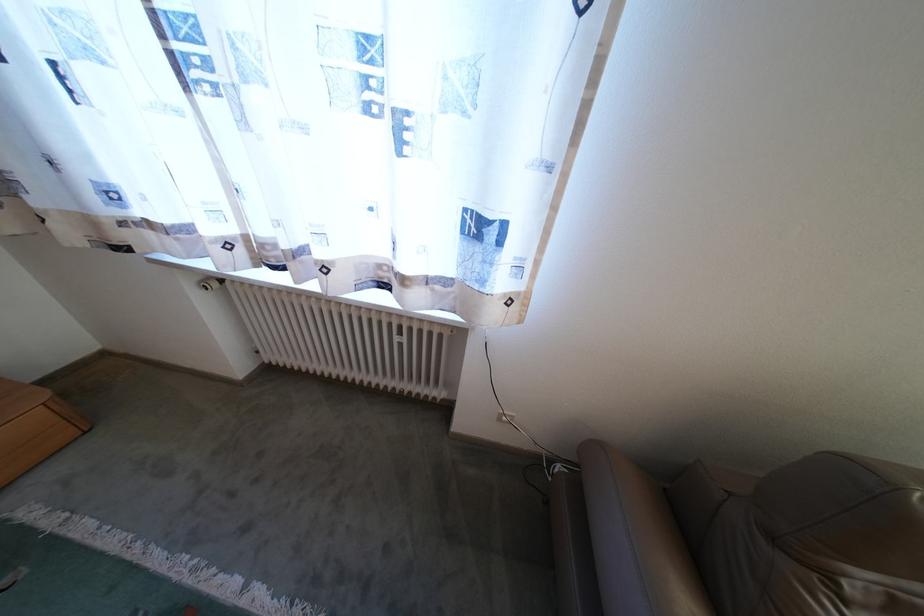
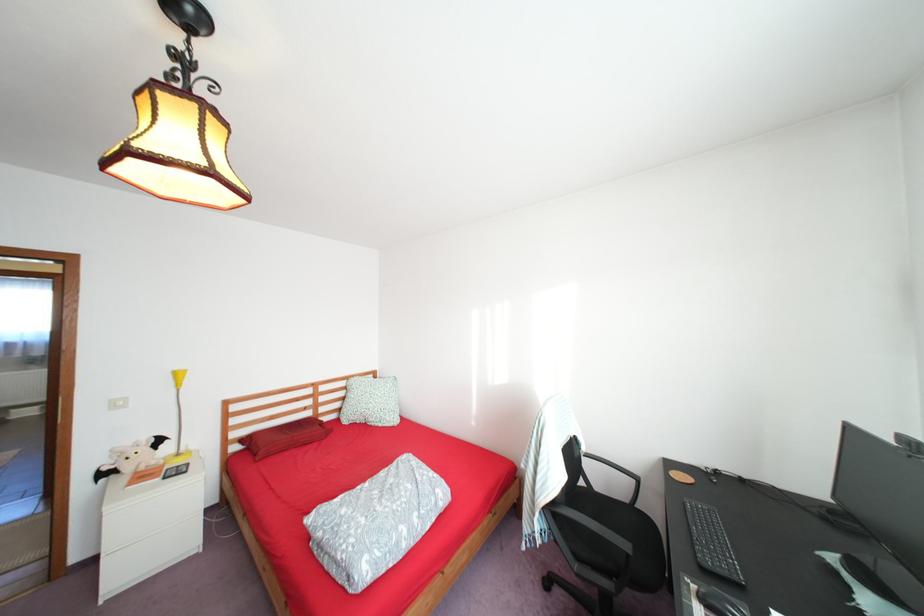
Question: I am providing you with two images of the same scene from different viewpoints. After the viewpoint changes to image2, which objects are now occluded?

Choices:
 (A) red wall clamp
 (B) black computer mouse
 (C) red rectangular pillow
 (D) brown sofa armrest

Answer: (D)